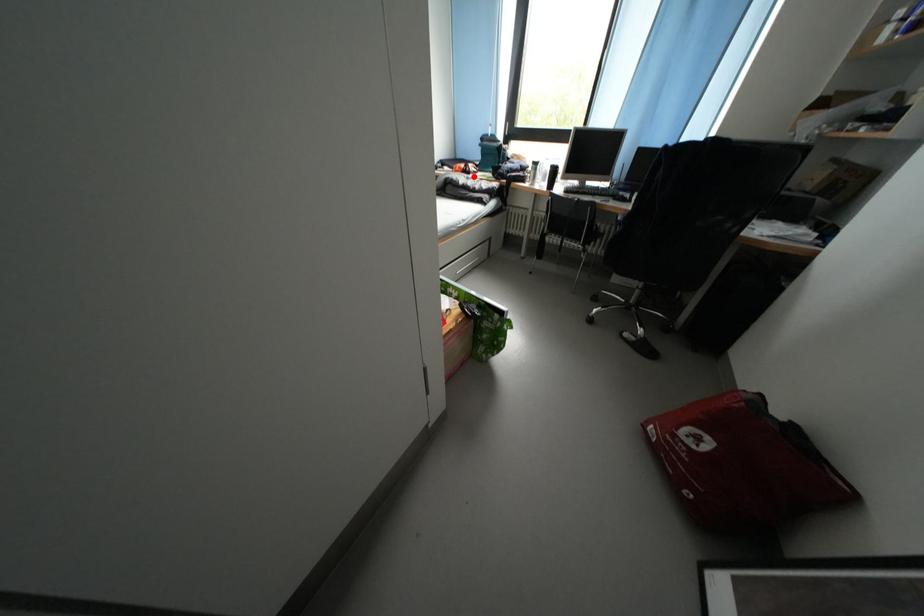
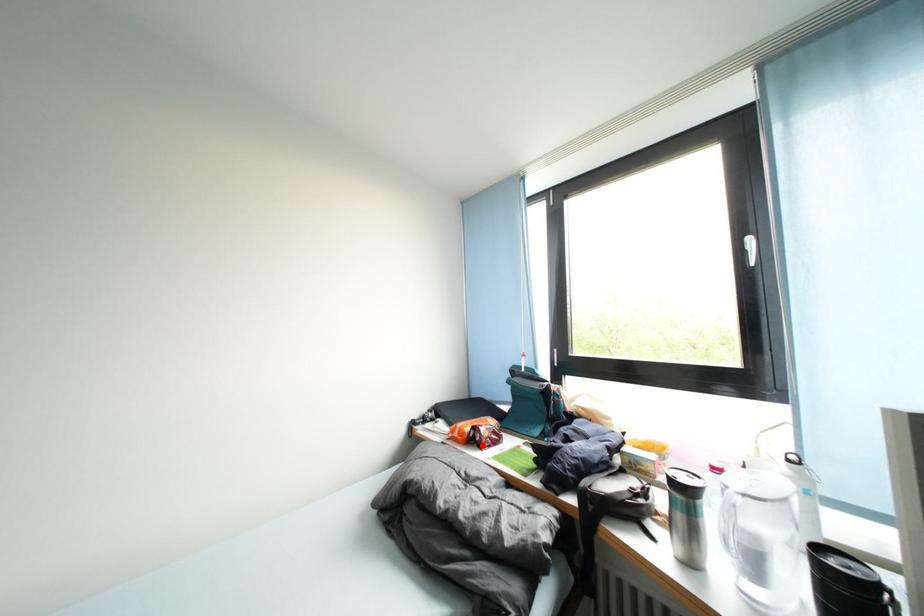
I am providing you with two images of the same scene from different viewpoints. A red point is marked on the first image and another point is marked on the second image. Are the points marked in image1 and image2 representing the same 3D position?

Yes